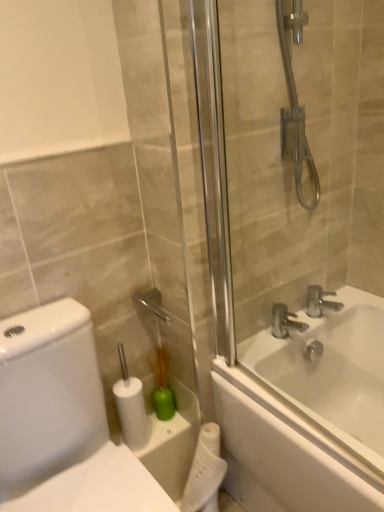
Question: From a real-world perspective, is silver metallic faucet at upper right, the 1th tap from the left, positioned above or below green plastic brush at lower center?

Choices:
 (A) below
 (B) above

Answer: (B)

Question: Based on their positions, is silver metallic faucet at upper right, positioned as the 2th tap in right-to-left order, located to the left or right of green plastic brush at lower center?

Choices:
 (A) left
 (B) right

Answer: (B)

Question: Which is farther from the silver metallic faucet at upper right, which is the 1th tap in right-to-left order?

Choices:
 (A) white matte toilet paper at lower center, the 2th toilet paper in the bottom-to-top sequence
 (B) silver metallic faucet at upper right, the 1th tap from the left
 (C) white glossy toilet at left
 (D) white matte toilet paper at lower center, which is the 2th toilet paper in top-to-bottom order
 (E) green plastic brush at lower center

Answer: (C)

Question: Which object is the farthest from the white glossy bathtub at center?

Choices:
 (A) white glossy toilet at left
 (B) transparent glass shower door at right
 (C) silver metallic faucet at upper right, which is the 1th tap in right-to-left order
 (D) silver metallic faucet at upper right, positioned as the 2th tap in right-to-left order
 (E) white matte toilet paper at lower center, the 2th toilet paper when ordered from left to right

Answer: (A)